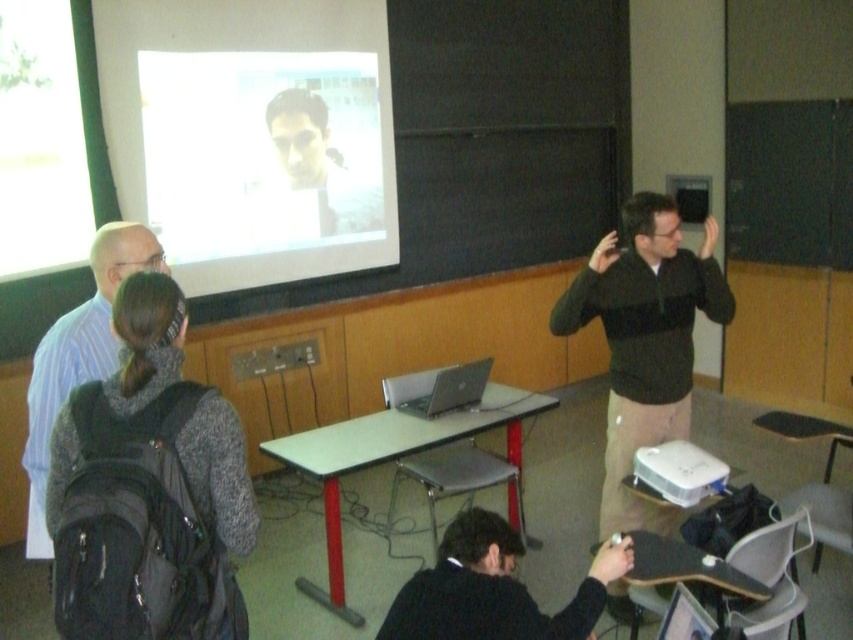
In the scene shown: Is white glossy projector screen at upper center to the right of gray sweater at left from the viewer's perspective?

Yes, white glossy projector screen at upper center is to the right of gray sweater at left.

Find the location of a particular element. white glossy projector screen at upper center is located at coordinates tap(251, 134).

Between black matte jacket at lower center and white glossy table at center, which one is positioned lower?

white glossy table at center is lower down.

Can you confirm if black matte jacket at lower center is shorter than white glossy table at center?

Yes.

What do you see at coordinates (492, 588) in the screenshot? The image size is (853, 640). I see `black matte jacket at lower center` at bounding box center [492, 588].

The image size is (853, 640). I want to click on black matte jacket at lower center, so click(492, 588).

Which is more to the left, white glossy projector screen at upper center or black matte jacket at lower center?

From the viewer's perspective, white glossy projector screen at upper center appears more on the left side.

Which of these two, white glossy projector screen at upper center or black matte jacket at lower center, stands taller?

Standing taller between the two is white glossy projector screen at upper center.

Between point (135, 28) and point (608, 541), which one is positioned behind?

Positioned behind is point (135, 28).

The height and width of the screenshot is (640, 853). Find the location of `white glossy projector screen at upper center`. white glossy projector screen at upper center is located at coordinates 251,134.